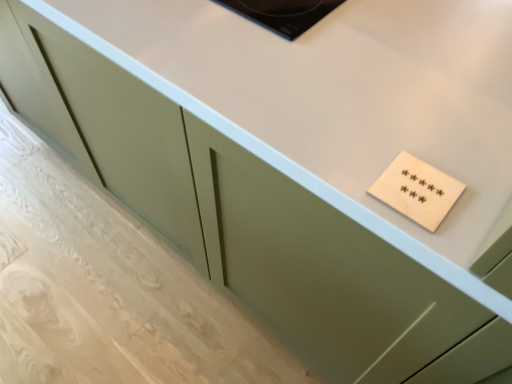
The width and height of the screenshot is (512, 384). Identify the location of wooden plaque at upper right. (417, 190).

What do you see at coordinates (417, 190) in the screenshot? I see `wooden plaque at upper right` at bounding box center [417, 190].

The image size is (512, 384). I want to click on wooden plaque at upper right, so point(417,190).